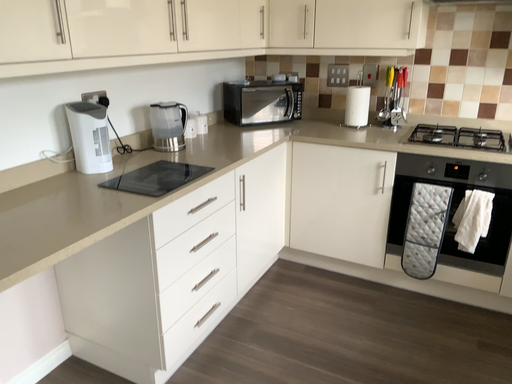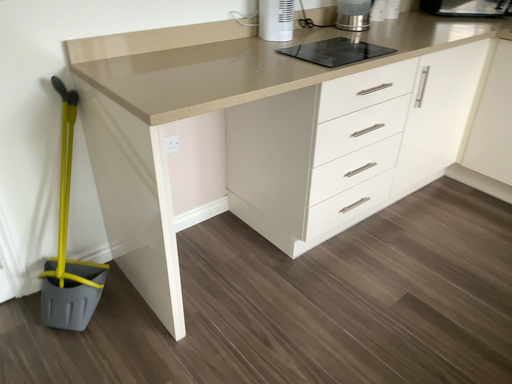
Question: How did the camera likely rotate when shooting the video?

Choices:
 (A) rotated upward
 (B) rotated downward

Answer: (B)